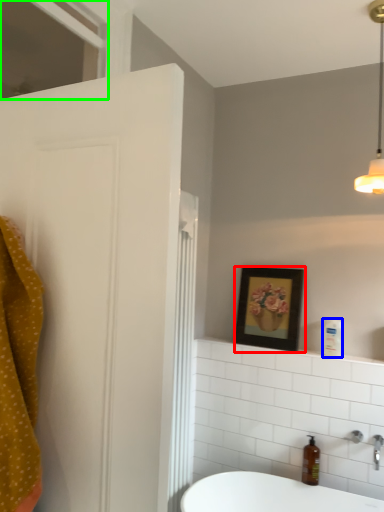
Question: Considering the real-world distances, which object is farthest from picture frame (highlighted by a red box)? toiletry (highlighted by a blue box) or window (highlighted by a green box)?

Choices:
 (A) toiletry
 (B) window

Answer: (B)